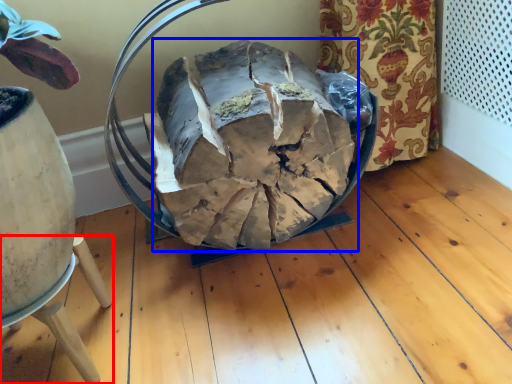
Question: Which point is further to the camera, furniture (highlighted by a red box) or food (highlighted by a blue box)?

Choices:
 (A) furniture
 (B) food

Answer: (B)